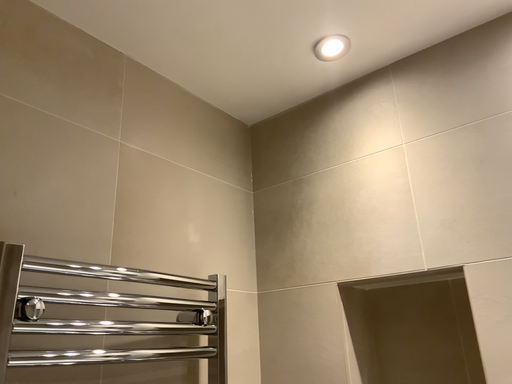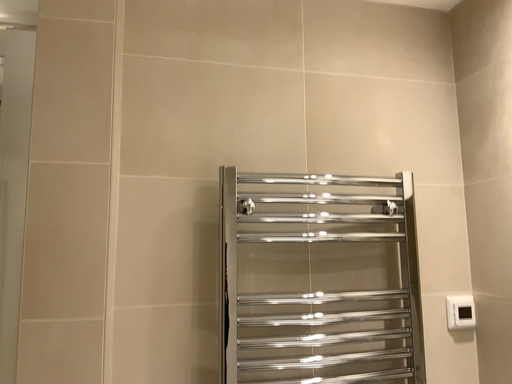
Question: Which way did the camera rotate in the video?

Choices:
 (A) rotated right
 (B) rotated left

Answer: (B)